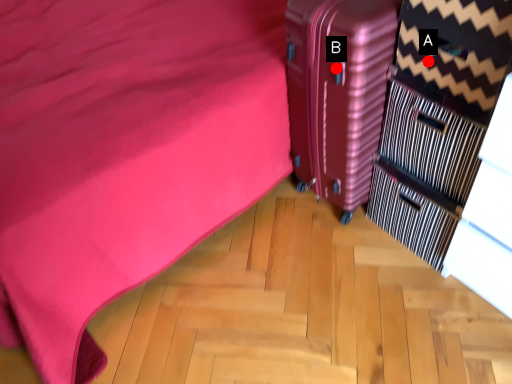
Question: Two points are circled on the image, labeled by A and B beside each circle. Which point appears farthest from the camera in this image?

Choices:
 (A) A is further
 (B) B is further

Answer: (B)